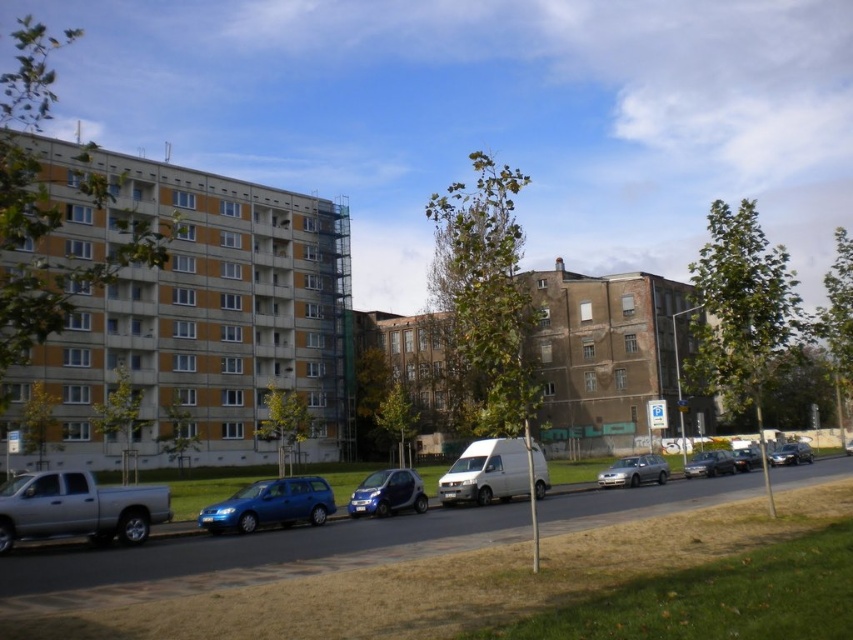
You are a delivery driver who needs to park your 1.8 meters wide truck in this parking spot. The parking spot can accommodate vehicles up to 2 meters wide. There are two vehicles in the center of the image, a white matte van at center and a metallic silver sedan at center. Which vehicle currently parked in the center has a width that allows your truck to fit in the parking spot if it vacates the spot?

The white matte van at center has a width less than the metallic silver sedan at center. Since your truck is 1.8 meters wide and the parking spot allows up to 2 meters, if the metallic silver sedan at center leaves, your truck can fit as it is wider than the van but still under the limit.

You are standing on the sidewalk in the image and want to cross the street to reach the white matte van at center. The crosswalk is 15 meters away. Can you safely reach the van without walking further than the crosswalk?

The white matte van at center is 12.84 meters away from the viewer, which is within the 15 meters crosswalk distance. Therefore, you can safely reach the van without walking further than the crosswalk.